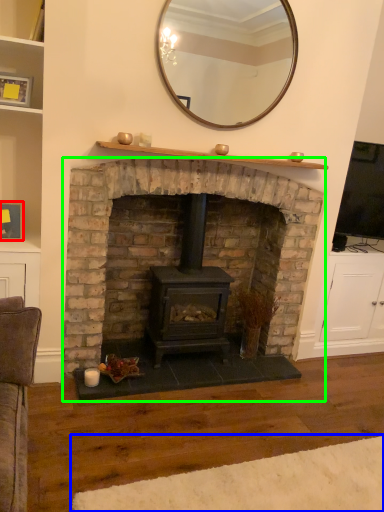
Question: Estimate the real-world distances between objects in this image. Which object is farther from picture frame (highlighted by a red box), plain (highlighted by a blue box) or fireplace (highlighted by a green box)?

Choices:
 (A) plain
 (B) fireplace

Answer: (A)